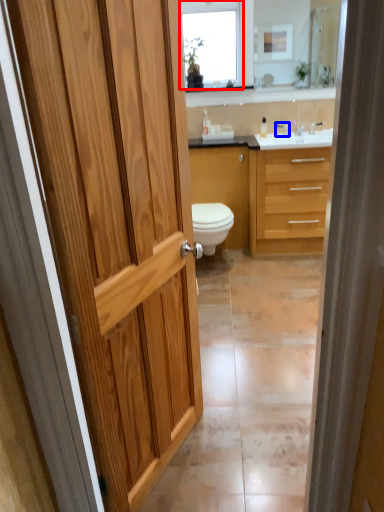
Question: Which object appears closest to the camera in this image, window (highlighted by a red box) or tap (highlighted by a blue box)?

Choices:
 (A) window
 (B) tap

Answer: (A)